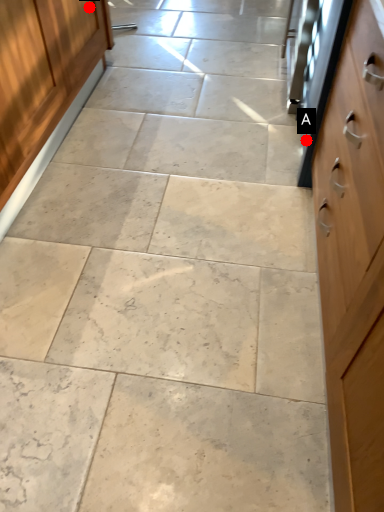
Question: Two points are circled on the image, labeled by A and B beside each circle. Which point is closer to the camera taking this photo?

Choices:
 (A) A is closer
 (B) B is closer

Answer: (A)